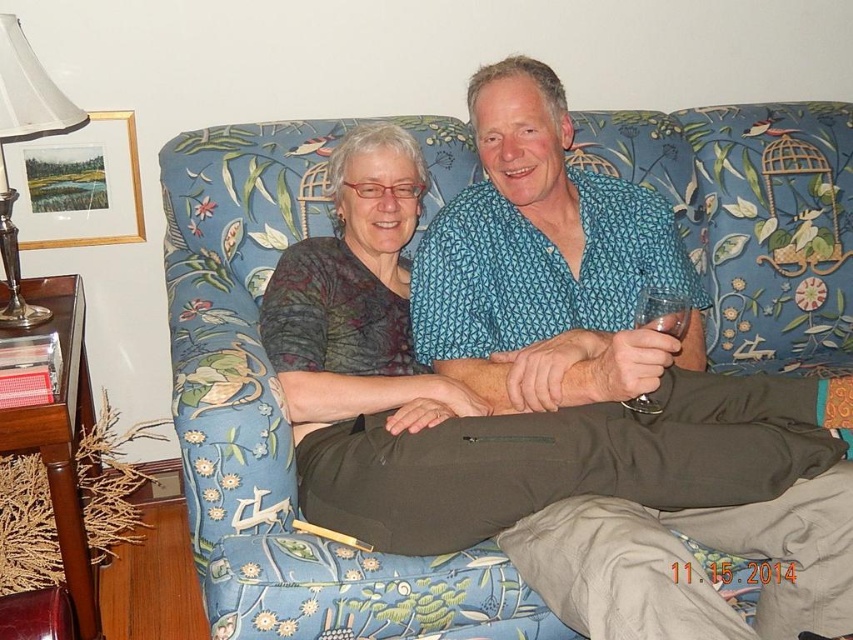
Question: Among these points, which one is nearest to the camera?

Choices:
 (A) (10, 220)
 (B) (799, 308)
 (C) (496, 189)

Answer: (C)

Question: Can you confirm if floral fabric couch at center is positioned to the right of silver metallic lampshade at upper left?

Choices:
 (A) yes
 (B) no

Answer: (A)

Question: Is blue printed shirt at center wider than silver metallic lampshade at upper left?

Choices:
 (A) yes
 (B) no

Answer: (A)

Question: Which point is farther to the camera?

Choices:
 (A) (578, 365)
 (B) (38, 72)

Answer: (B)

Question: Estimate the real-world distances between objects in this image. Which object is closer to the silver metallic lampshade at upper left?

Choices:
 (A) blue printed shirt at center
 (B) floral fabric couch at center

Answer: (B)

Question: In this image, where is floral fabric couch at center located relative to silver metallic lampshade at upper left?

Choices:
 (A) left
 (B) right

Answer: (B)